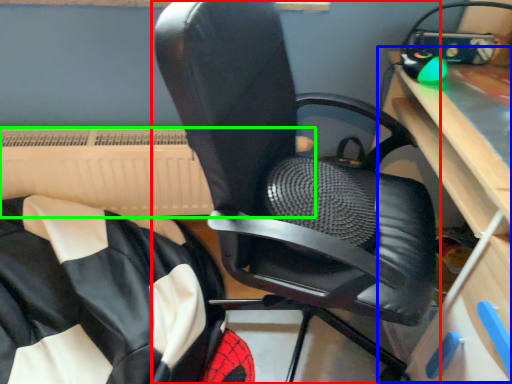
Question: Which is nearer to the chair (highlighted by a red box)? computer desk (highlighted by a blue box) or radiator (highlighted by a green box).

Choices:
 (A) computer desk
 (B) radiator

Answer: (A)